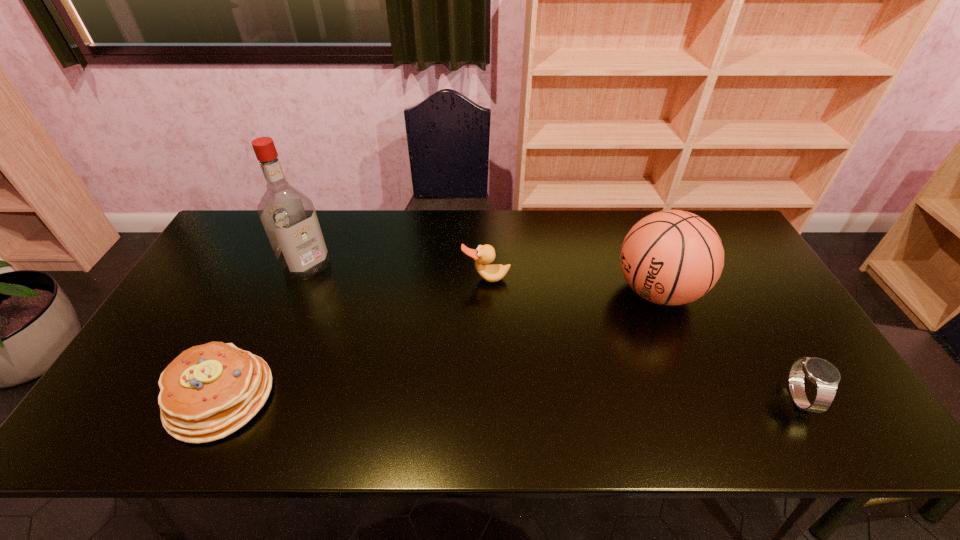
Identify the location of pancake. (x=209, y=391).

Locate an element on the screen. This screenshot has height=540, width=960. the rightmost object is located at coordinates (825, 376).

Find the location of a particular element. The width and height of the screenshot is (960, 540). the third object from right to left is located at coordinates tap(484, 254).

You are a GUI agent. You are given a task and a screenshot of the screen. Output one action in this format:
    pyautogui.click(x=<x>, y=<y>)
    Task: Click on the fourth shortest object
    
    Given the screenshot: What is the action you would take?
    pyautogui.click(x=672, y=257)

Image resolution: width=960 pixels, height=540 pixels. What are the coordinates of `basketball` in the screenshot? It's located at (672, 257).

Identify the location of the tallest object. pyautogui.click(x=288, y=216).

Find the location of `free region located on the back of the pancake`. free region located on the back of the pancake is located at coordinates (282, 268).

This screenshot has width=960, height=540. Identify the location of vacant area situated on the back of the watch. (731, 282).

Where is `vacant space positioned on the beak of the third object from left to right`? The width and height of the screenshot is (960, 540). vacant space positioned on the beak of the third object from left to right is located at coordinates (488, 303).

Where is `vacant area located on the beak of the third object from left to right`? vacant area located on the beak of the third object from left to right is located at coordinates tap(491, 352).